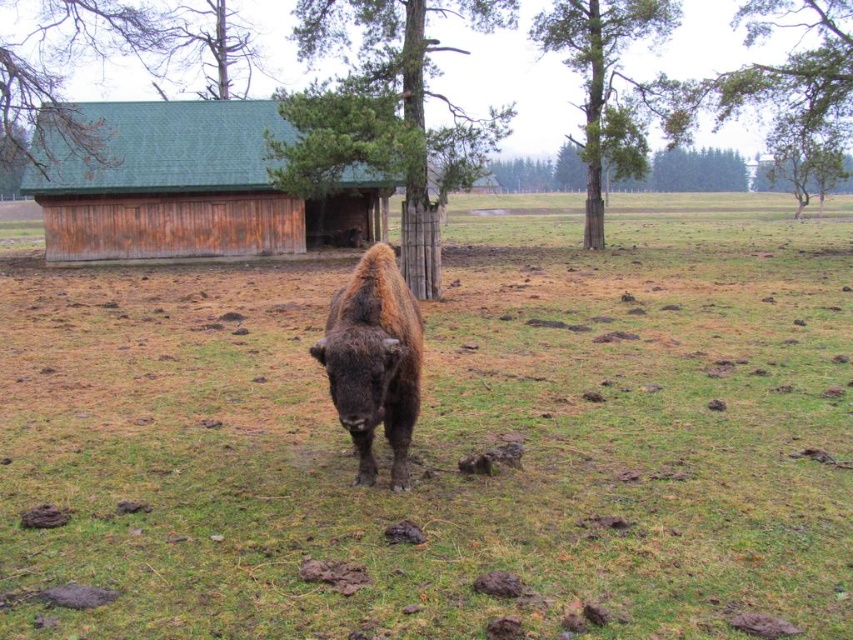
You are a photographer trying to capture a clear photo of the brown fuzzy yak at center without the green wood tree at center blocking it. Which direction should you move to achieve this?

The green wood tree at center is positioned over the brown fuzzy yak at center, so moving to the side either left or right would allow you to position yourself where the tree no longer blocks the yak.

You are a photographer standing at the camera position. You want to take a photo of the green wood tree at center but also include the bison in the shot. Given that the bison is closer to the camera than the tree, will the bison block the view of the tree in your photo?

The green wood tree at center is 40.53 feet away from the camera. Since the bison is closer to the camera than the tree, it will block the view of the tree in the photo if positioned between the camera and the tree.

You are a farmer checking the field. You notice the green grassy field at center and the green rough bark tree at upper center. Which one is taller?

The green rough bark tree at upper center is taller than the green grassy field at center.